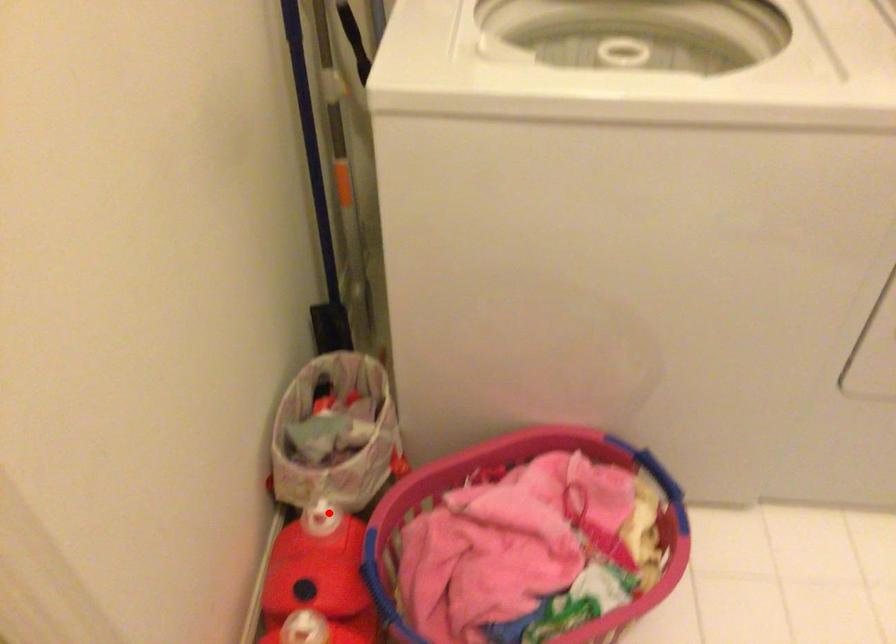
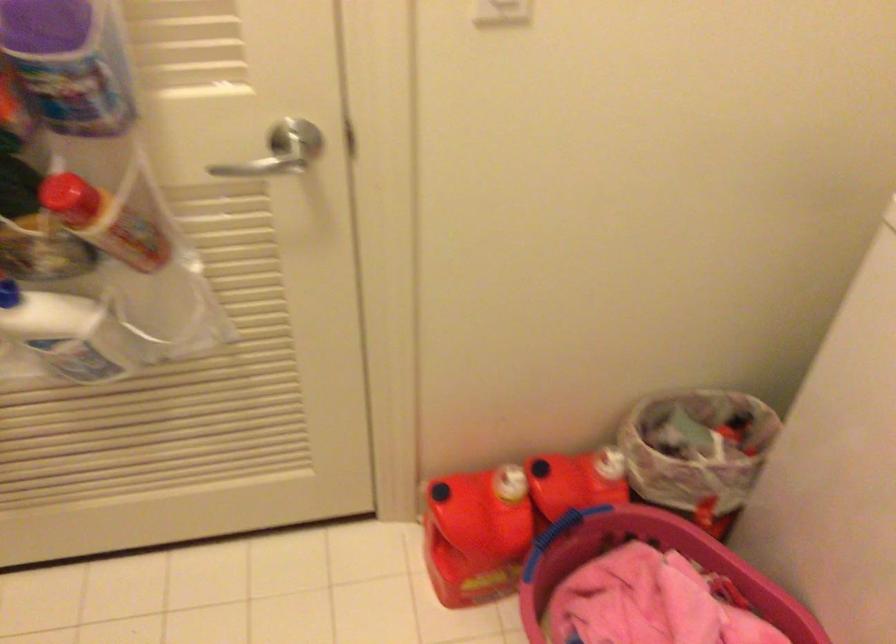
Question: A red point is marked in image1. In image2, is the corresponding 3D point closer to the camera or farther? Reply with the corresponding letter.

Choices:
 (A) The corresponding 3D point is closer.
 (B) The corresponding 3D point is farther.

Answer: (B)